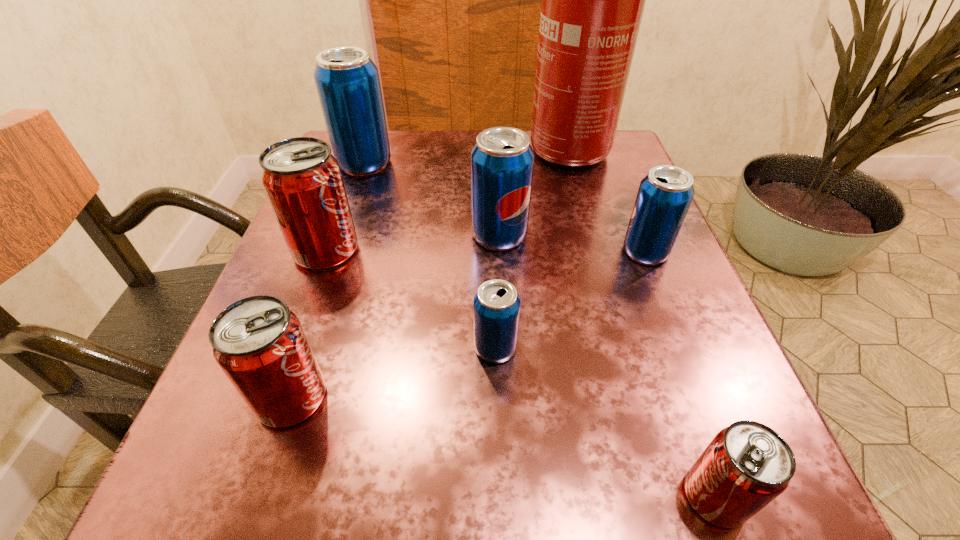
The width and height of the screenshot is (960, 540). Identify the location of vacant region between the second nearest red pop soda and the nearest object. (503, 447).

Identify the location of unoccupied position between the rightmost blue pop soda and the farthest red pop soda. (486, 251).

Image resolution: width=960 pixels, height=540 pixels. What are the coordinates of `free spot between the fire extinguisher and the biggest blue pop soda` in the screenshot? It's located at (461, 158).

What are the coordinates of `vacant space that is in between the second biggest blue pop soda and the farthest pop soda` in the screenshot? It's located at click(x=432, y=199).

You are a GUI agent. You are given a task and a screenshot of the screen. Output one action in this format:
    pyautogui.click(x=<x>, y=<y>)
    Task: Click on the object that stands as the fourth closest to the red fire extinguisher
    This screenshot has width=960, height=540.
    Given the screenshot: What is the action you would take?
    pyautogui.click(x=302, y=179)

Find the location of a particular element. object that is the third closest to the tallest object is located at coordinates (347, 81).

Identify which pop soda is located as the nearest to the farthest pop soda. Please provide its 2D coordinates. Your answer should be formatted as a tuple, i.e. [(x, y)], where the tuple contains the x and y coordinates of a point satisfying the conditions above.

[(302, 179)]

Choose which pop soda is the nearest neighbor to the biggest red pop soda. Please provide its 2D coordinates. Your answer should be formatted as a tuple, i.e. [(x, y)], where the tuple contains the x and y coordinates of a point satisfying the conditions above.

[(347, 81)]

The image size is (960, 540). I want to click on the closest blue pop soda to the tallest pop soda, so click(502, 160).

Select which blue pop soda is the fourth closest to the biggest red pop soda. Please provide its 2D coordinates. Your answer should be formatted as a tuple, i.e. [(x, y)], where the tuple contains the x and y coordinates of a point satisfying the conditions above.

[(664, 196)]